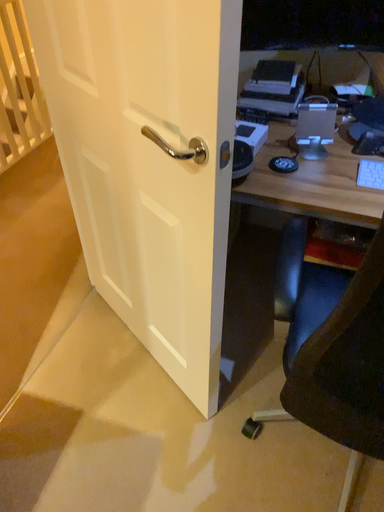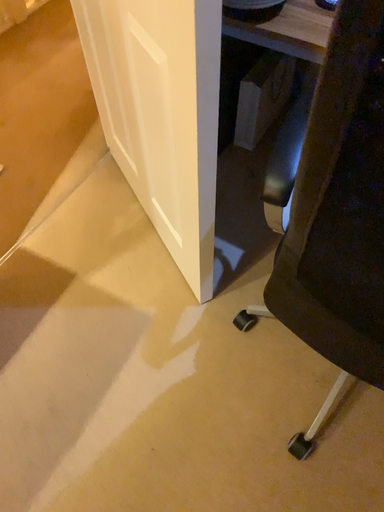
Question: Which way did the camera rotate in the video?

Choices:
 (A) rotated downward
 (B) rotated upward

Answer: (A)